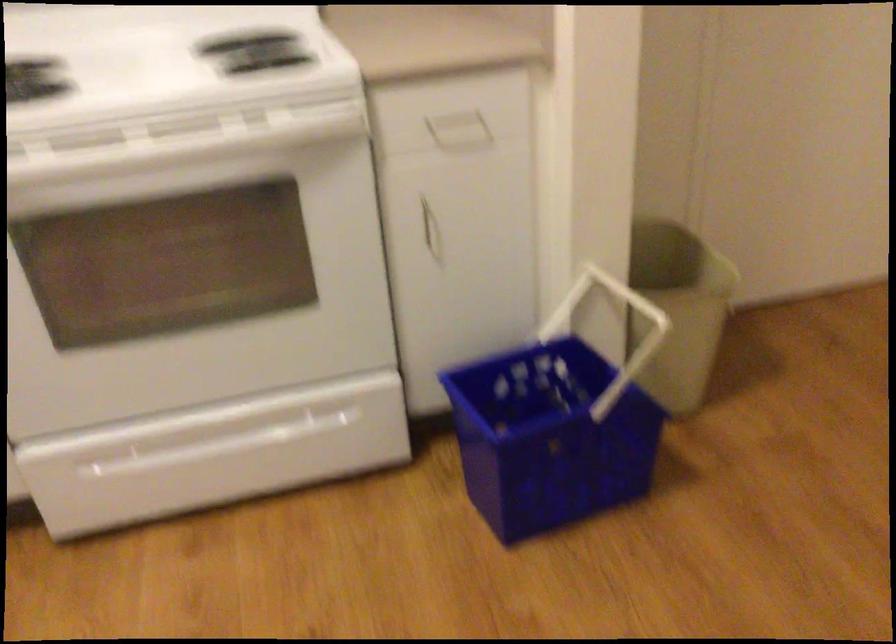
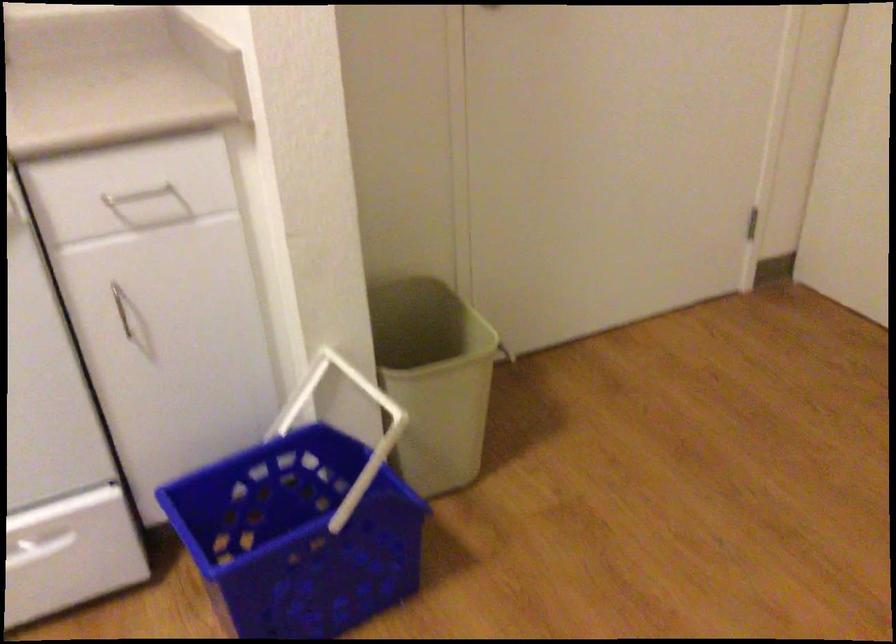
In the second image, find the point that corresponds to (593,317) in the first image.

(343, 402)